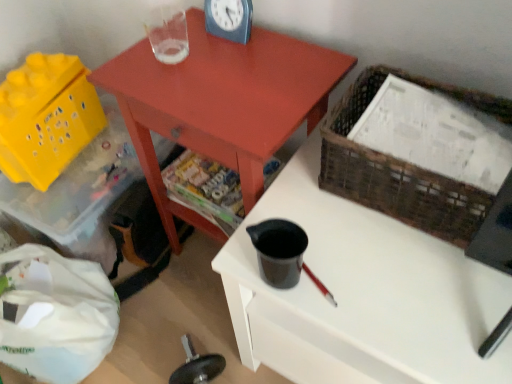
The height and width of the screenshot is (384, 512). In order to click on vacant area on top of matte red table at center (from a real-world perspective) in this screenshot , I will do `click(227, 66)`.